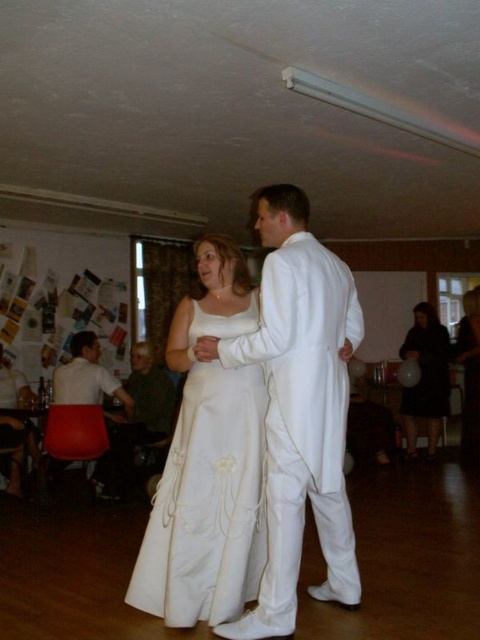
You are a photographer setting up for a wedding photo session in the described hall. You need to position a spotlight so it illuminates both the satin white suit at center and the black satin dress at lower right equally. Given their positions, where should you place the spotlight relative to the couple?

The satin white suit at center is above the black satin dress at lower right, so placing the spotlight above the couple would ensure equal illumination on both the satin white suit at center and the black satin dress at lower right.

You are a photographer at the wedding reception and need to position a backdrop behind the couple. The backdrop is 1.8 meters tall. Considering the height of the satin white suit at center and the white satin robe at center, will the backdrop be tall enough to cover both?

The satin white suit at center is much taller than the white satin robe at center. The tallest object between them is the satin white suit at center. Since the backdrop is 1.8 meters tall, it will depend on the actual height of the satin white suit at center. However, the description only states relative height, not absolute measurements. Without knowing the exact height of the satin white suit at center, we cannot definitively determine if the backdrop is sufficient.

You are a photographer setting up for a group photo. You need to position the satin white suit at center and the black satin dress at lower right so that both fit comfortably in the frame. Which one requires more horizontal space due to its width?

The satin white suit at center might require more horizontal space because it is wider than the black satin dress at lower right according to the description.